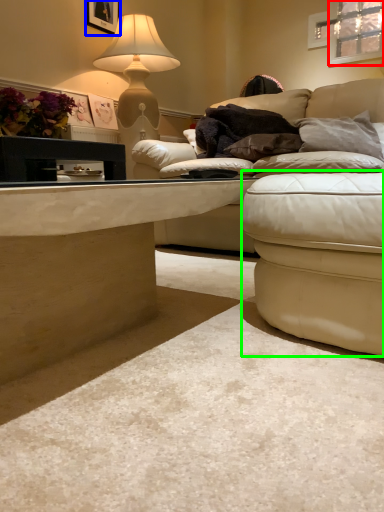
Question: Based on their relative distances, which object is farther from window (highlighted by a red box)? Choose from picture frame (highlighted by a blue box) and swivel chair (highlighted by a green box).

Choices:
 (A) picture frame
 (B) swivel chair

Answer: (B)